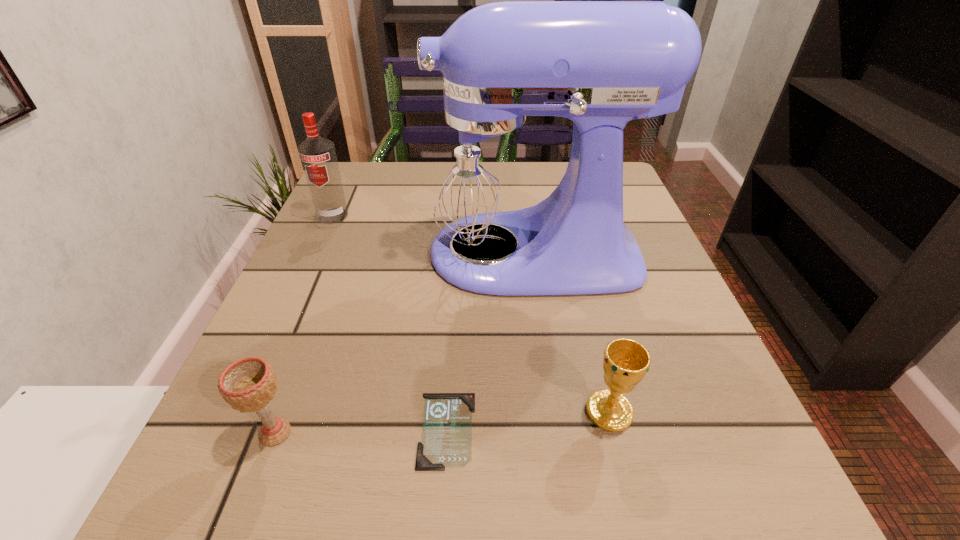
The image size is (960, 540). In order to click on the tallest object in this screenshot , I will do `click(487, 176)`.

At what (x,y) coordinates should I click in order to perform the action: click on the second tallest object. Please return your answer as a coordinate pair (x, y). This screenshot has width=960, height=540. Looking at the image, I should click on (318, 157).

Where is `the left chalice`? This screenshot has width=960, height=540. the left chalice is located at coordinates (248, 384).

This screenshot has width=960, height=540. Find the location of `the right chalice`. the right chalice is located at coordinates (626, 362).

The width and height of the screenshot is (960, 540). Identify the location of the shortest object. (446, 441).

The width and height of the screenshot is (960, 540). Find the location of `vacant space located 0.230m at the mixing area of the mixer`. vacant space located 0.230m at the mixing area of the mixer is located at coordinates (303, 253).

Find the location of `free space located at the mixing area of the mixer`. free space located at the mixing area of the mixer is located at coordinates (299, 253).

You are a GUI agent. You are given a task and a screenshot of the screen. Output one action in this format:
    pyautogui.click(x=<x>, y=<y>)
    Task: Click on the vacant space located 0.190m at the mixing area of the mixer
    
    Given the screenshot: What is the action you would take?
    point(323,253)

Locate an element on the screen. This screenshot has width=960, height=540. vacant space situated on the front label of the vodka is located at coordinates (297, 294).

Where is `free location located on the right of the left chalice`? free location located on the right of the left chalice is located at coordinates (413, 433).